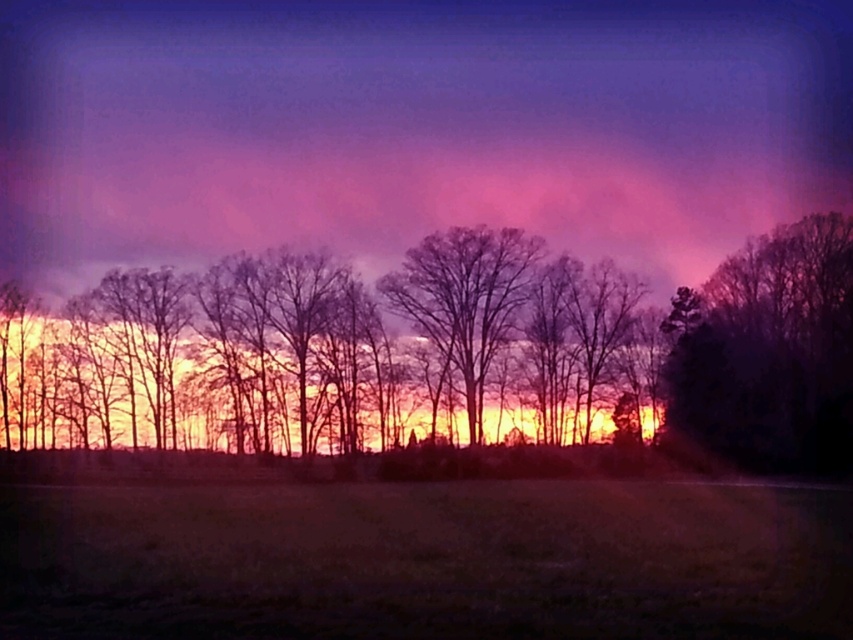
Between purple cotton candy cloud at upper center and silhouette tree at center, which one has less height?

silhouette tree at center is shorter.

Does point (508, 131) lie in front of point (289, 340)?

No, it is not.

The width and height of the screenshot is (853, 640). I want to click on purple cotton candy cloud at upper center, so click(415, 128).

Who is positioned more to the right, silhouette tree at center or bare branches at center?

Positioned to the right is bare branches at center.

Who is more distant from viewer, (453, 440) or (497, 324)?

Positioned behind is point (497, 324).

Find the location of a particular element. silhouette tree at center is located at coordinates (450, 355).

From the picture: Does dark green textured tree at right have a lesser width compared to bare branches at center?

Yes.

Where is `dark green textured tree at right`? This screenshot has height=640, width=853. dark green textured tree at right is located at coordinates (772, 353).

Find the location of a particular element. This screenshot has width=853, height=640. dark green textured tree at right is located at coordinates (772, 353).